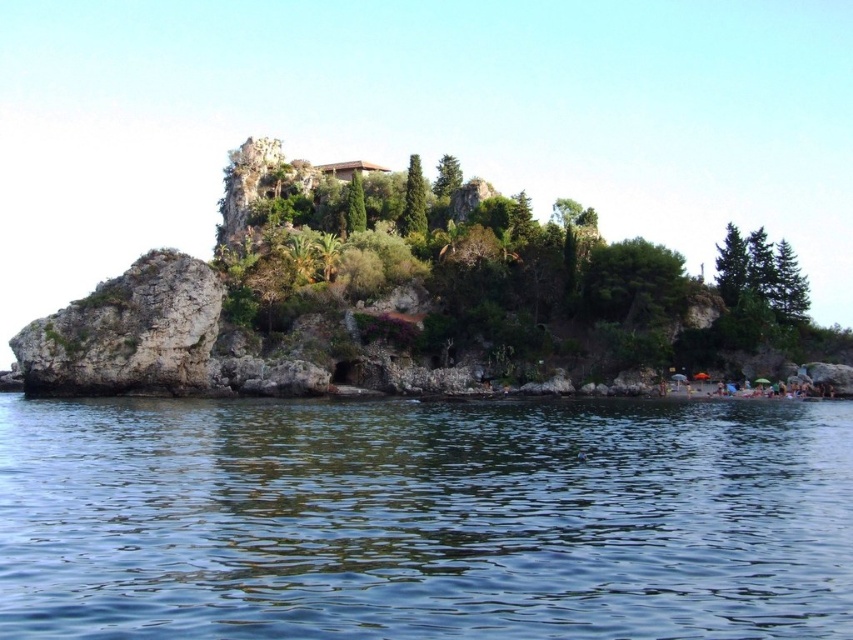
You are a boat captain navigating through the coastal area shown. You need to pass between the clear blue water at lower center and the rocky cliff at left. Can your 10 meter wide boat safely navigate this passage?

The clear blue water at lower center is wider than the rocky cliff at left. Since the boat is 10 meters wide, it can safely navigate the passage as the water is wider than the cliff, providing sufficient space.

You are standing on the rocky cliff at left and want to observe the clear blue water at lower center. In which direction should you turn your head to see it?

You should turn your head to the right to see the clear blue water at lower center, as it is located to the right of the rocky cliff at left.

You are standing on the rocky cliff at left and want to jump into the clear blue water at lower center. Considering the height difference between the two, what should you be cautious about?

The rocky cliff at left is taller than the clear blue water at lower center. You should be cautious of the height difference, as jumping from the cliff into the water could be dangerous due to the significant drop.